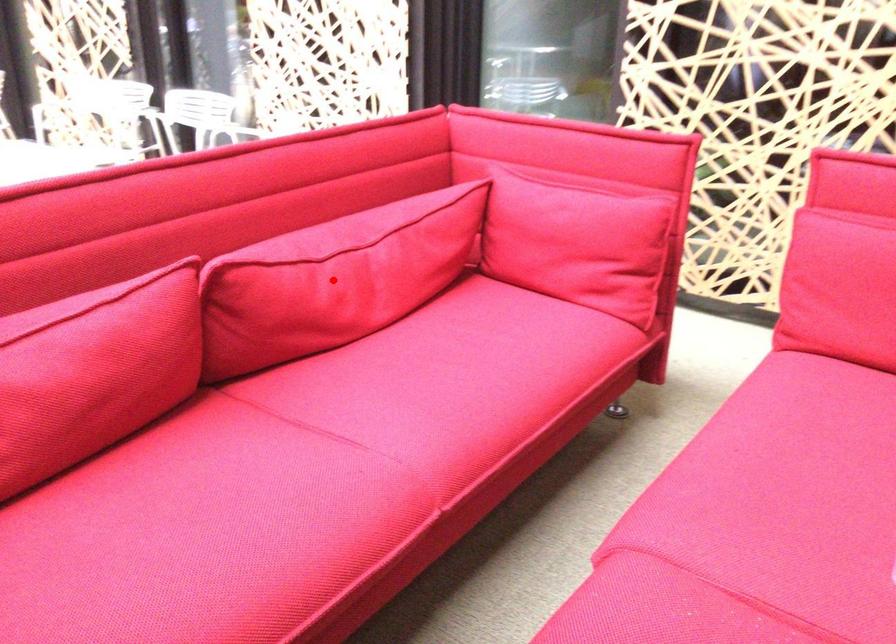
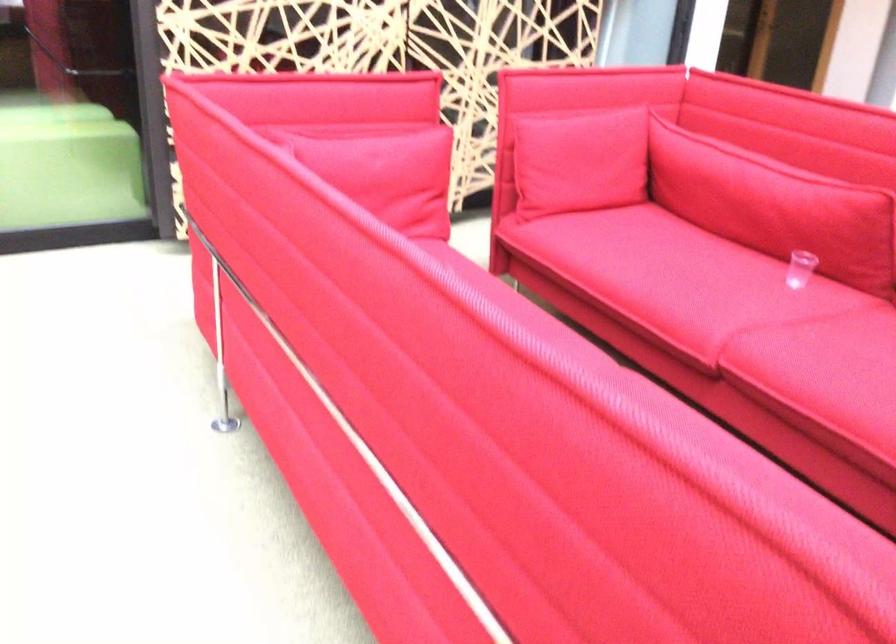
Question: I am providing you with two images of the same scene from different viewpoints. A red point is marked on the first image. Can you still see the location of the red point in image 2?

Choices:
 (A) Yes
 (B) No

Answer: (B)